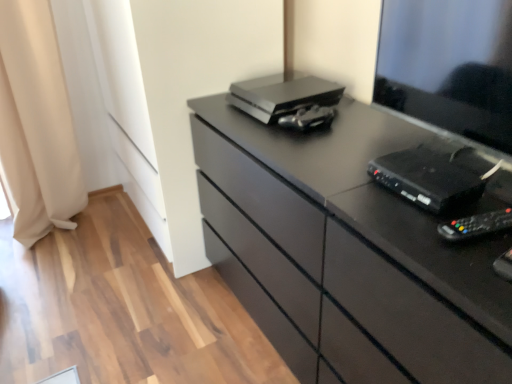
Question: From the image's perspective, would you say black plastic remote control at right, which is the 1th equipment from front to back, is shown under black plastic desktop at right?

Choices:
 (A) no
 (B) yes

Answer: (B)

Question: Is black plastic remote control at right, which is the first equipment from bottom to top, shorter than black plastic desktop at right?

Choices:
 (A) yes
 (B) no

Answer: (A)

Question: From a real-world perspective, is black plastic remote control at right, the 3th equipment viewed from the top, located higher than black plastic desktop at right?

Choices:
 (A) no
 (B) yes

Answer: (A)

Question: Is black plastic remote control at right, which is the first equipment from bottom to top, beside black plastic desktop at right?

Choices:
 (A) yes
 (B) no

Answer: (B)

Question: From a real-world perspective, does black plastic remote control at right, acting as the 3th equipment starting from the back, sit lower than black plastic desktop at right?

Choices:
 (A) no
 (B) yes

Answer: (B)

Question: Does black plastic remote control at right, acting as the 3th equipment starting from the back, lie behind black plastic desktop at right?

Choices:
 (A) no
 (B) yes

Answer: (B)

Question: Is metallic silver game controller at center, which ranks as the first equipment in back-to-front order, facing away from black plastic desktop at right?

Choices:
 (A) no
 (B) yes

Answer: (A)

Question: Does metallic silver game controller at center, which is the 3th equipment in front-to-back order, have a larger size compared to black plastic desktop at right?

Choices:
 (A) yes
 (B) no

Answer: (B)

Question: Does metallic silver game controller at center, which is counted as the 3th equipment, starting from the bottom, lie in front of black plastic desktop at right?

Choices:
 (A) no
 (B) yes

Answer: (A)

Question: From the image's perspective, does metallic silver game controller at center, which ranks as the first equipment in back-to-front order, appear higher than black plastic desktop at right?

Choices:
 (A) no
 (B) yes

Answer: (A)

Question: Is metallic silver game controller at center, which is counted as the 3th equipment, starting from the bottom, thinner than black plastic desktop at right?

Choices:
 (A) no
 (B) yes

Answer: (A)

Question: Does metallic silver game controller at center, placed as the first equipment when sorted from top to bottom, appear on the right side of black plastic desktop at right?

Choices:
 (A) yes
 (B) no

Answer: (B)

Question: From the image's perspective, would you say matte black chest of drawers at center is positioned over metallic silver game controller at center, which ranks as the first equipment in back-to-front order?

Choices:
 (A) yes
 (B) no

Answer: (B)